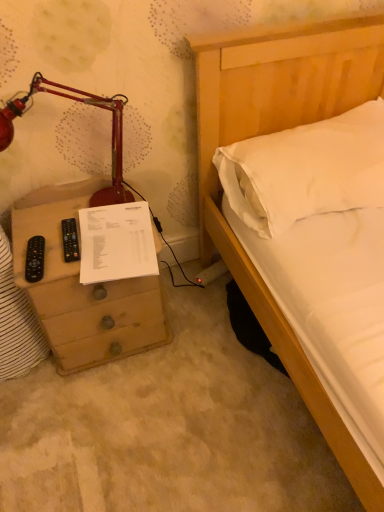
What do you see at coordinates (82, 288) in the screenshot? I see `wooden chest of drawers at left` at bounding box center [82, 288].

Describe the element at coordinates (35, 259) in the screenshot. Image resolution: width=384 pixels, height=512 pixels. I see `black plastic remote at left` at that location.

Find the location of a particular element. The image size is (384, 512). white soft pillow at upper right is located at coordinates (306, 170).

Image resolution: width=384 pixels, height=512 pixels. I want to click on wooden chest of drawers at left, so click(x=82, y=288).

Considering the positions of objects white soft pillow at upper right and white paper at left in the image provided, who is more to the left, white soft pillow at upper right or white paper at left?

white paper at left.

From a real-world perspective, which is physically below, white soft pillow at upper right or white paper at left?

From a 3D spatial view, white paper at left is below.

Would you say white soft pillow at upper right is inside or outside white paper at left?

white soft pillow at upper right is not enclosed by white paper at left.

You are a GUI agent. You are given a task and a screenshot of the screen. Output one action in this format:
    pyautogui.click(x=<x>, y=<y>)
    Task: Click on the document that appears below the white soft pillow at upper right (from the image's perspective)
    The height and width of the screenshot is (512, 384).
    Given the screenshot: What is the action you would take?
    pyautogui.click(x=116, y=243)

Does wooden chest of drawers at left have a greater width compared to black plastic remote at left?

Yes.

Based on the photo, considering the sizes of wooden chest of drawers at left and black plastic remote at left in the image, is wooden chest of drawers at left bigger or smaller than black plastic remote at left?

wooden chest of drawers at left is bigger than black plastic remote at left.

In the scene shown: Does wooden chest of drawers at left touch black plastic remote at left?

wooden chest of drawers at left and black plastic remote at left are clearly separated.

From a real-world perspective, relative to black plastic remote at left, is wooden chest of drawers at left vertically above or below?

Clearly, from a real-world perspective, wooden chest of drawers at left is below black plastic remote at left.

In terms of width, does matte red lamp at left look wider or thinner when compared to white paper at left?

Considering their sizes, matte red lamp at left looks slimmer than white paper at left.

Can you confirm if matte red lamp at left is shorter than white paper at left?

No.

From the image's perspective, is matte red lamp at left located above or below white paper at left?

matte red lamp at left is above white paper at left.

Which object is further away from the camera, matte red lamp at left or white paper at left?

white paper at left is further away from the camera.

Considering the sizes of objects black plastic remote at left and white paper at left in the image provided, who is bigger, black plastic remote at left or white paper at left?

white paper at left.

From the image's perspective, is black plastic remote at left on top of white paper at left?

Incorrect, from the image's perspective, black plastic remote at left is lower than white paper at left.

Based on the photo, does black plastic remote at left have a lesser height compared to white paper at left?

Yes.

Is black plastic remote at left inside or outside of white paper at left?

black plastic remote at left is not enclosed by white paper at left.

From the picture: Is black plastic remote at left at the right side of black plastic remote at left?

Correct, you'll find black plastic remote at left to the right of black plastic remote at left.

In the scene shown: Could you tell me if black plastic remote at left is turned towards black plastic remote at left?

No, black plastic remote at left is not oriented towards black plastic remote at left.

How far apart are black plastic remote at left and black plastic remote at left?

3.38 inches.

Could black plastic remote at left be considered to be inside black plastic remote at left?

No, black plastic remote at left is not inside black plastic remote at left.

Is white paper at left to the left of white soft pillow at upper right from the viewer's perspective?

Yes, white paper at left is to the left of white soft pillow at upper right.

Between white paper at left and white soft pillow at upper right, which one has larger width?

Wider between the two is white soft pillow at upper right.

Which is closer, [116,219] or [382,103]?

Point [116,219] is closer to the camera than point [382,103].

Is white paper at left oriented towards white soft pillow at upper right?

No, white paper at left does not turn towards white soft pillow at upper right.

Considering the relative sizes of black plastic remote at left and wooden chest of drawers at left in the image provided, is black plastic remote at left bigger than wooden chest of drawers at left?

No.

Which is in front, black plastic remote at left or wooden chest of drawers at left?

wooden chest of drawers at left is in front.

The image size is (384, 512). In order to click on remote above the wooden chest of drawers at left (from a real-world perspective) in this screenshot , I will do `click(35, 259)`.

Considering the sizes of black plastic remote at left and wooden chest of drawers at left in the image, is black plastic remote at left taller or shorter than wooden chest of drawers at left?

black plastic remote at left is shorter than wooden chest of drawers at left.

The width and height of the screenshot is (384, 512). I want to click on pillow in front of the white paper at left, so click(x=306, y=170).

At what (x,y) coordinates should I click in order to perform the action: click on chest of drawers that appears on the right of black plastic remote at left. Please return your answer as a coordinate pair (x, y). The width and height of the screenshot is (384, 512). Looking at the image, I should click on (82, 288).

Which object lies further to the anchor point black plastic remote at left, black plastic remote at left or white paper at left?

white paper at left lies further to black plastic remote at left than the other object.

When comparing their distances from matte red lamp at left, does black plastic remote at left or wooden chest of drawers at left seem closer?

The object closer to matte red lamp at left is wooden chest of drawers at left.

Which object lies nearer to the anchor point white paper at left, black plastic remote at left or white soft pillow at upper right?

black plastic remote at left.

Which object lies nearer to the anchor point white paper at left, white soft pillow at upper right or wooden chest of drawers at left?

wooden chest of drawers at left lies closer to white paper at left than the other object.

Estimate the real-world distances between objects in this image. Which object is further from white paper at left, black plastic remote at left or black plastic remote at left?

Among the two, black plastic remote at left is located further to white paper at left.

Considering their positions, is white paper at left positioned closer to black plastic remote at left than wooden chest of drawers at left?

white paper at left lies closer to black plastic remote at left than the other object.

Looking at the image, which one is located further to white paper at left, black plastic remote at left or wooden chest of drawers at left?

wooden chest of drawers at left is further to white paper at left.

Which object lies further to the anchor point matte red lamp at left, white paper at left or black plastic remote at left?

The object further to matte red lamp at left is black plastic remote at left.

This screenshot has height=512, width=384. I want to click on chest of drawers between matte red lamp at left and white soft pillow at upper right, so click(x=82, y=288).

Image resolution: width=384 pixels, height=512 pixels. I want to click on control between matte red lamp at left and black plastic remote at left in the vertical direction, so (70, 240).

Where is `control situated between black plastic remote at left and white paper at left from left to right`? The width and height of the screenshot is (384, 512). control situated between black plastic remote at left and white paper at left from left to right is located at coordinates (70, 240).

Identify the location of control between matte red lamp at left and white paper at left vertically. (70, 240).